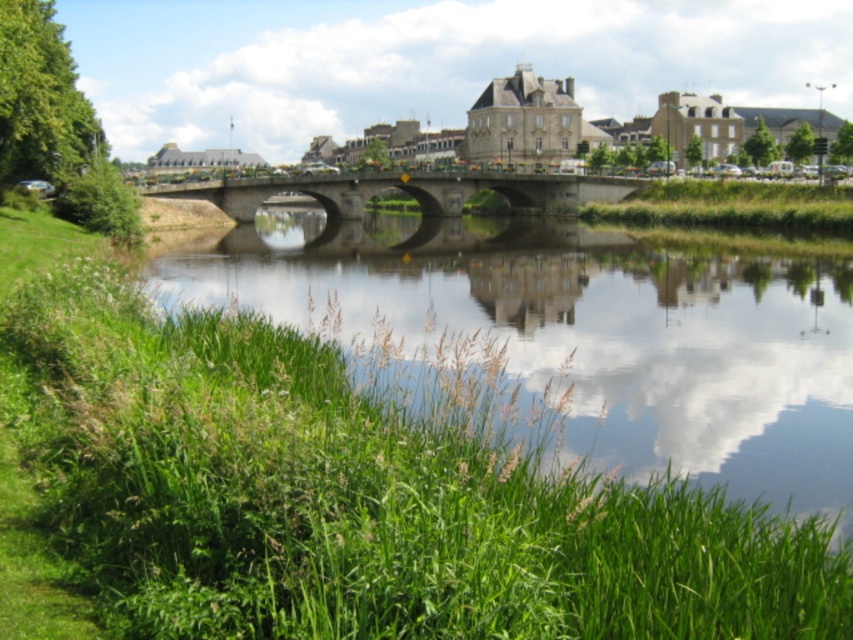
Question: Does green grassy river at lower center have a larger size compared to concrete bridge at center?

Choices:
 (A) no
 (B) yes

Answer: (B)

Question: Which point is closer to the camera?

Choices:
 (A) green grassy river at lower center
 (B) concrete bridge at center

Answer: (A)

Question: Is the position of green grassy river at lower center less distant than that of concrete bridge at center?

Choices:
 (A) yes
 (B) no

Answer: (A)

Question: Among these points, which one is farthest from the camera?

Choices:
 (A) tap(601, 362)
 (B) tap(561, 189)

Answer: (B)

Question: Which point is closer to the camera?

Choices:
 (A) (367, 177)
 (B) (166, 252)

Answer: (B)

Question: Does green grassy river at lower center appear over concrete bridge at center?

Choices:
 (A) yes
 (B) no

Answer: (B)